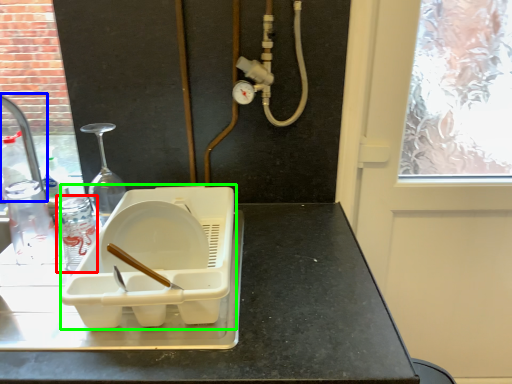
Question: Which is farther away from bottle (highlighted by a red box)? faucet (highlighted by a blue box) or appliance (highlighted by a green box)?

Choices:
 (A) faucet
 (B) appliance

Answer: (A)